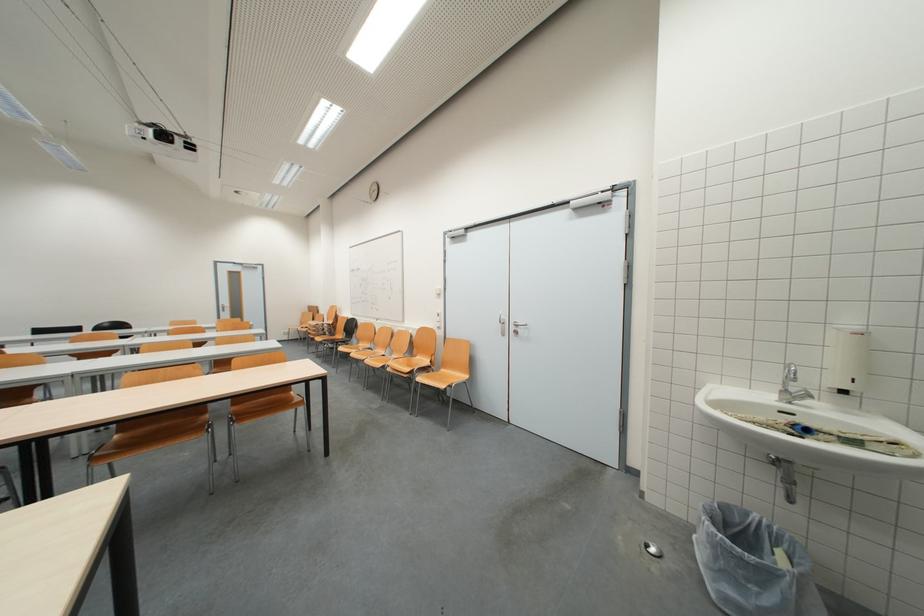
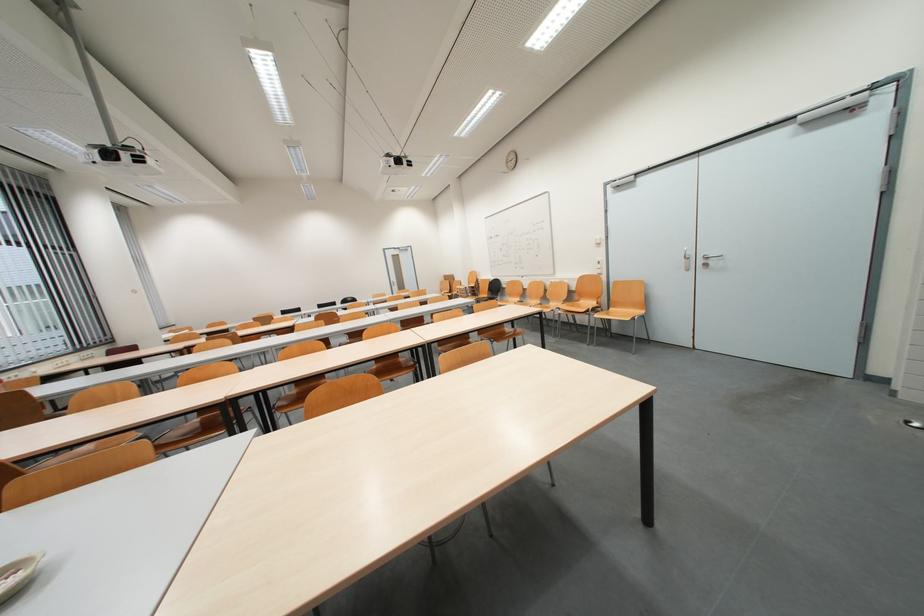
The images are taken continuously from a first-person perspective. In which direction are you moving?

The movement direction of the cameraman is left, backward.